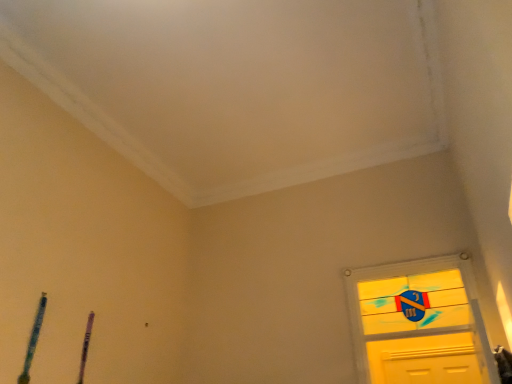
Question: Is purple wood pen at lower left, which ranks as the 2th twin in front-to-back order, closer to the viewer compared to blue textured pencil at lower left, the first twin in the left-to-right sequence?

Choices:
 (A) yes
 (B) no

Answer: (B)

Question: Is purple wood pen at lower left, which is the 2th twin from left to right, to the right of blue textured pencil at lower left, the second twin positioned from the back, from the viewer's perspective?

Choices:
 (A) no
 (B) yes

Answer: (B)

Question: Is purple wood pen at lower left, which ranks as the 2th twin in front-to-back order, next to blue textured pencil at lower left, the second twin viewed from the right?

Choices:
 (A) no
 (B) yes

Answer: (A)

Question: Is purple wood pen at lower left, which is the 2th twin from left to right, far away from blue textured pencil at lower left, the first twin from the front?

Choices:
 (A) no
 (B) yes

Answer: (A)

Question: Is blue textured pencil at lower left, the first twin from the front, surrounded by purple wood pen at lower left, which ranks as the 2th twin in front-to-back order?

Choices:
 (A) no
 (B) yes

Answer: (A)

Question: Does purple wood pen at lower left, acting as the first twin starting from the back, come behind blue textured pencil at lower left, the second twin positioned from the back?

Choices:
 (A) no
 (B) yes

Answer: (B)

Question: From a real-world perspective, is blue textured pencil at lower left, the second twin viewed from the right, physically below purple wood pen at lower left, acting as the first twin starting from the back?

Choices:
 (A) yes
 (B) no

Answer: (A)

Question: Is blue textured pencil at lower left, the first twin in the left-to-right sequence, turned away from purple wood pen at lower left, which appears as the first twin when viewed from the right?

Choices:
 (A) yes
 (B) no

Answer: (B)

Question: Can you confirm if blue textured pencil at lower left, the first twin in the left-to-right sequence, is thinner than purple wood pen at lower left, which ranks as the 2th twin in front-to-back order?

Choices:
 (A) no
 (B) yes

Answer: (A)

Question: Is blue textured pencil at lower left, the second twin viewed from the right, surrounding purple wood pen at lower left, which is the 2th twin from left to right?

Choices:
 (A) yes
 (B) no

Answer: (B)

Question: Does blue textured pencil at lower left, the second twin viewed from the right, lie behind purple wood pen at lower left, which is the 2th twin from left to right?

Choices:
 (A) yes
 (B) no

Answer: (B)

Question: Is blue textured pencil at lower left, the first twin in the left-to-right sequence, closer to camera compared to purple wood pen at lower left, which appears as the first twin when viewed from the right?

Choices:
 (A) no
 (B) yes

Answer: (B)

Question: Is point (82, 365) positioned closer to the camera than point (31, 329)?

Choices:
 (A) farther
 (B) closer

Answer: (A)